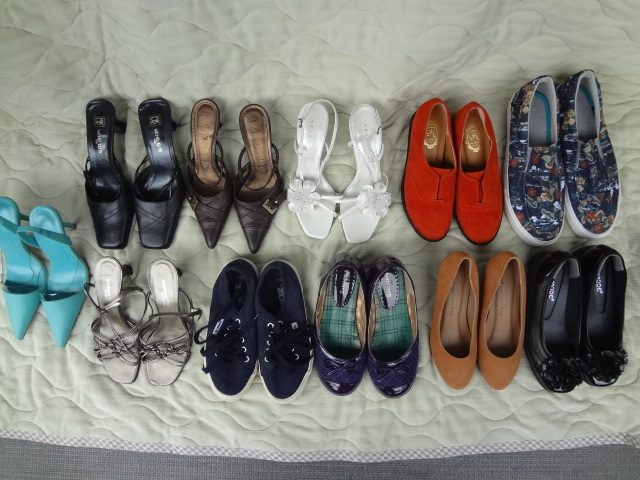
Where is `shoe pairs in bottom row`? The width and height of the screenshot is (640, 480). shoe pairs in bottom row is located at coordinates (49, 277), (121, 311), (230, 329), (364, 328), (451, 324), (541, 308).